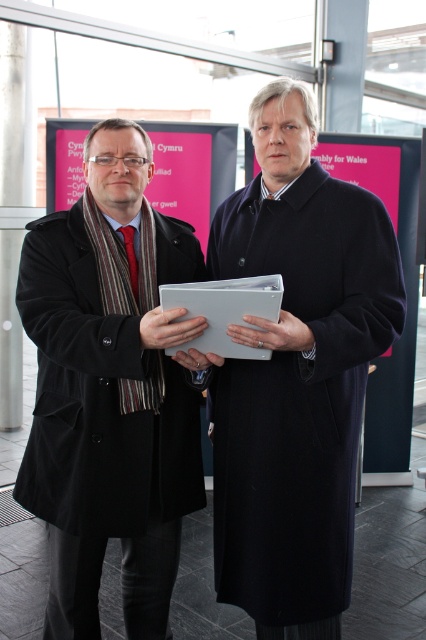
Question: Does dark wool coat at center appear over matte gray folder at center?

Choices:
 (A) no
 (B) yes

Answer: (A)

Question: Among these objects, which one is farthest from the camera?

Choices:
 (A) black matte coat at left
 (B) matte gray folder at center

Answer: (A)

Question: Which point is farther to the camera?

Choices:
 (A) (147, 452)
 (B) (310, 209)
 (C) (250, 276)

Answer: (B)

Question: From the image, what is the correct spatial relationship of dark wool coat at center in relation to matte gray folder at center?

Choices:
 (A) right
 (B) left

Answer: (A)

Question: Is dark wool coat at center below black matte coat at left?

Choices:
 (A) no
 (B) yes

Answer: (A)

Question: Which object is farther from the camera taking this photo?

Choices:
 (A) black matte coat at left
 (B) dark wool coat at center

Answer: (A)